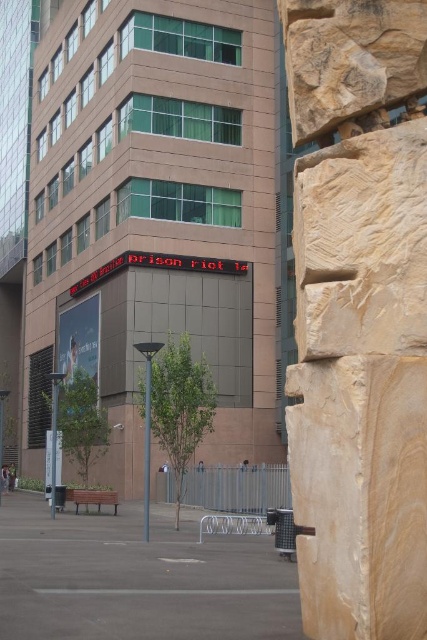
Question: Does brown concrete plaza at center have a larger size compared to sandstone textured wall at right?

Choices:
 (A) no
 (B) yes

Answer: (B)

Question: Which point is closer to the camera?

Choices:
 (A) sandstone textured wall at right
 (B) brown concrete plaza at center

Answer: (A)

Question: In this image, where is brown concrete plaza at center located relative to sandstone textured wall at right?

Choices:
 (A) above
 (B) below

Answer: (A)

Question: Which object appears closest to the camera in this image?

Choices:
 (A) brown concrete plaza at center
 (B) sandstone textured wall at right

Answer: (B)

Question: Which point is farther to the camera?

Choices:
 (A) brown concrete plaza at center
 (B) sandstone textured wall at right

Answer: (A)

Question: Observing the image, what is the correct spatial positioning of brown concrete plaza at center in reference to sandstone textured wall at right?

Choices:
 (A) above
 (B) below

Answer: (A)